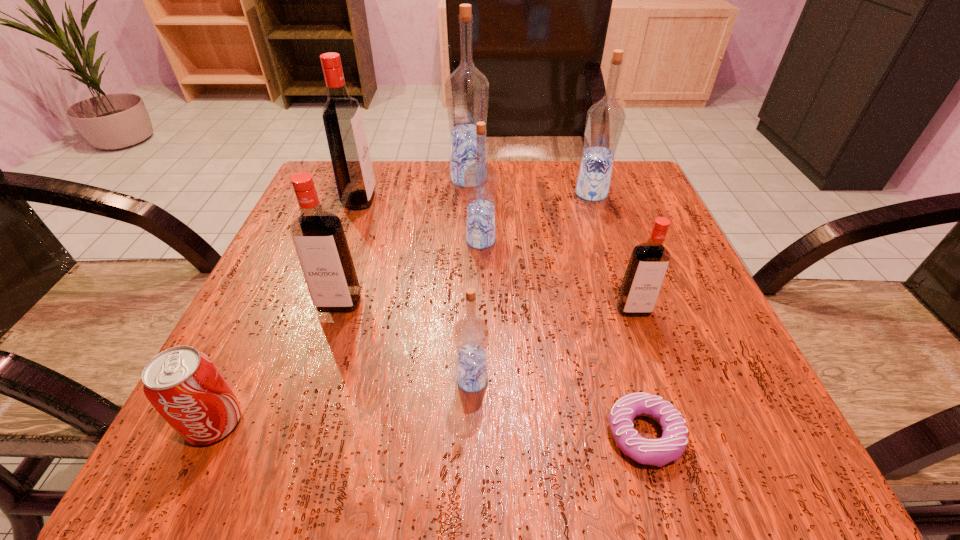
Select which blue vodka is the second closest to the smallest blue vodka. Please provide its 2D coordinates. Your answer should be formatted as a tuple, i.e. [(x, y)], where the tuple contains the x and y coordinates of a point satisfying the conditions above.

[(605, 120)]

Where is `blue vodka that is the closest to the rightmost red vodka`? This screenshot has height=540, width=960. blue vodka that is the closest to the rightmost red vodka is located at coordinates [471, 333].

Where is `the second closest red vodka to the nearest blue vodka`? The image size is (960, 540). the second closest red vodka to the nearest blue vodka is located at coordinates (649, 261).

Locate an element on the screen. This screenshot has width=960, height=540. red vodka that stands as the closest to the fourth farthest object is located at coordinates (319, 239).

Identify the location of vacant space that satisfies the following two spatial constraints: 1. on the back side of the sixth nearest object; 2. on the front and back of the farthest red vodka. (481, 200).

The height and width of the screenshot is (540, 960). Identify the location of vacant space that satisfies the following two spatial constraints: 1. on the front side of the second shortest object; 2. on the right side of the purple doughnut. (209, 435).